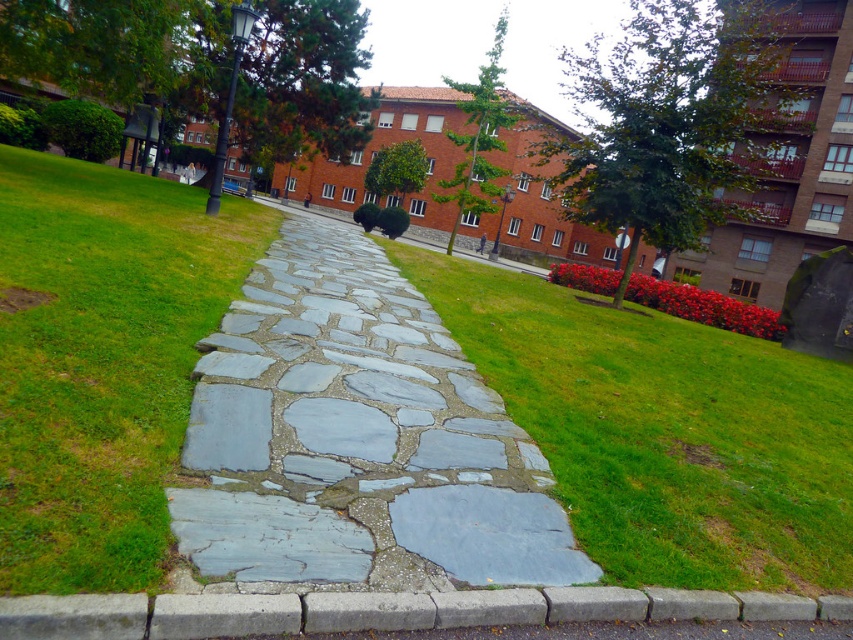
Who is positioned more to the right, gray stone path at center or gray concrete curb at lower center?

gray concrete curb at lower center

Who is more forward, (x=485, y=502) or (x=744, y=618)?

Point (x=744, y=618)

Is point (434, 349) behind point (408, 595)?

That is True.

Locate an element on the screen. The height and width of the screenshot is (640, 853). gray stone path at center is located at coordinates (357, 438).